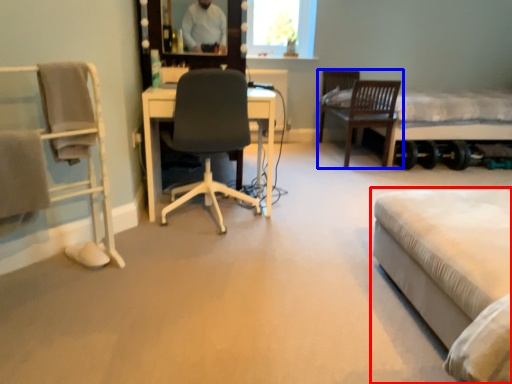
Question: Which object appears closest to the camera in this image, bed (highlighted by a red box) or chair (highlighted by a blue box)?

Choices:
 (A) bed
 (B) chair

Answer: (A)